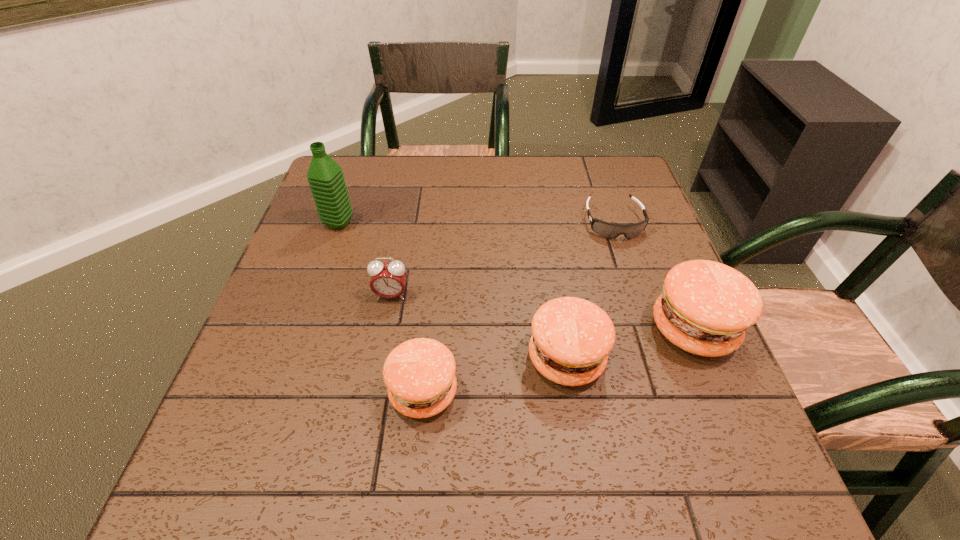
Please point a free position for a patty on the left. Please provide its 2D coordinates. Your answer should be formatted as a tuple, i.e. [(x, y)], where the tuple contains the x and y coordinates of a point satisfying the conditions above.

[(262, 429)]